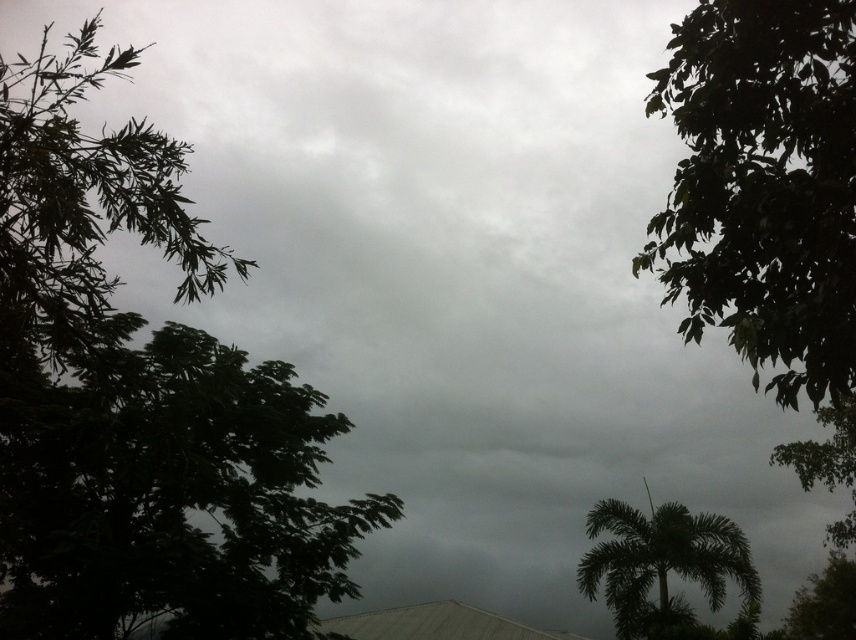
Question: Which point is farther to the camera?

Choices:
 (A) green leafy palm tree at lower right
 (B) green leafy tree at upper right

Answer: (A)

Question: Which object is positioned closest to the green leafy tree at upper right?

Choices:
 (A) green leafy palm tree at lower right
 (B) green leafy tree at left

Answer: (B)

Question: Does green leafy tree at upper right have a greater width compared to green leafy palm tree at lower right?

Choices:
 (A) yes
 (B) no

Answer: (A)

Question: Does green leafy tree at left appear on the right side of green leafy palm tree at lower right?

Choices:
 (A) no
 (B) yes

Answer: (A)

Question: Does green leafy tree at left have a lesser width compared to green leafy tree at upper right?

Choices:
 (A) yes
 (B) no

Answer: (B)

Question: Which object is farther from the camera taking this photo?

Choices:
 (A) green leafy palm tree at lower right
 (B) green leafy tree at left

Answer: (A)